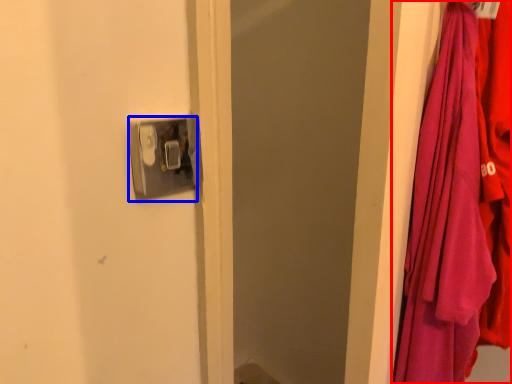
Question: Which of the following is the farthest to the observer, curtain (highlighted by a red box) or door handle (highlighted by a blue box)?

Choices:
 (A) curtain
 (B) door handle

Answer: (B)